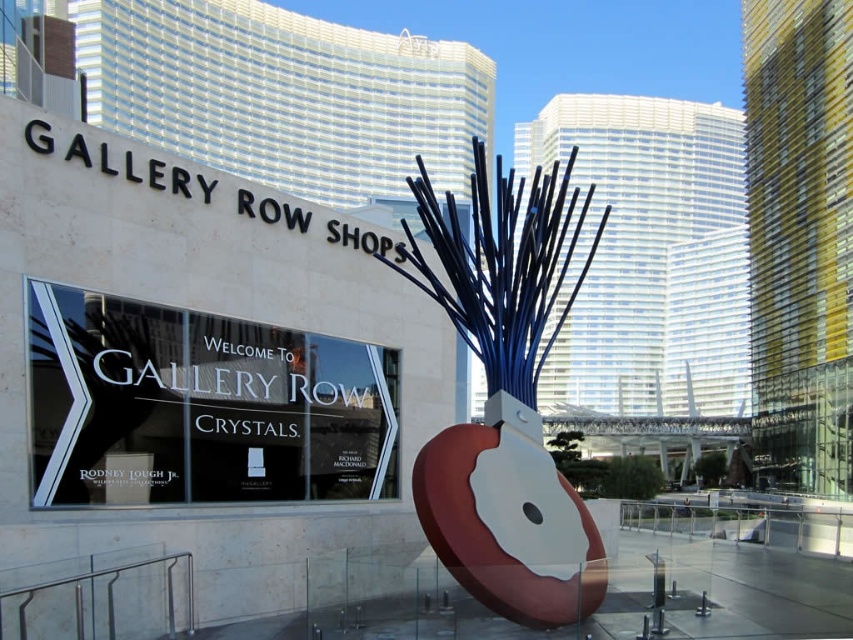
You are a visitor approaching the entrance of Gallery Row Shops and see the white glass sign at center and the matte blue metal spikes at center. Which object is closer to you as you approach?

The white glass sign at center is closer to you because it is further to the viewer than the matte blue metal spikes at center.

You are standing at the entrance of Gallery Row Shops and notice two points marked on the ground. One is at coordinates point [218,340] and the other at point [531,307]. If you want to walk towards the point that is further away from you, which coordinates should you head towards?

Point [218,340] is behind point [531,307], so you should head towards point [218,340] to walk towards the one further away.